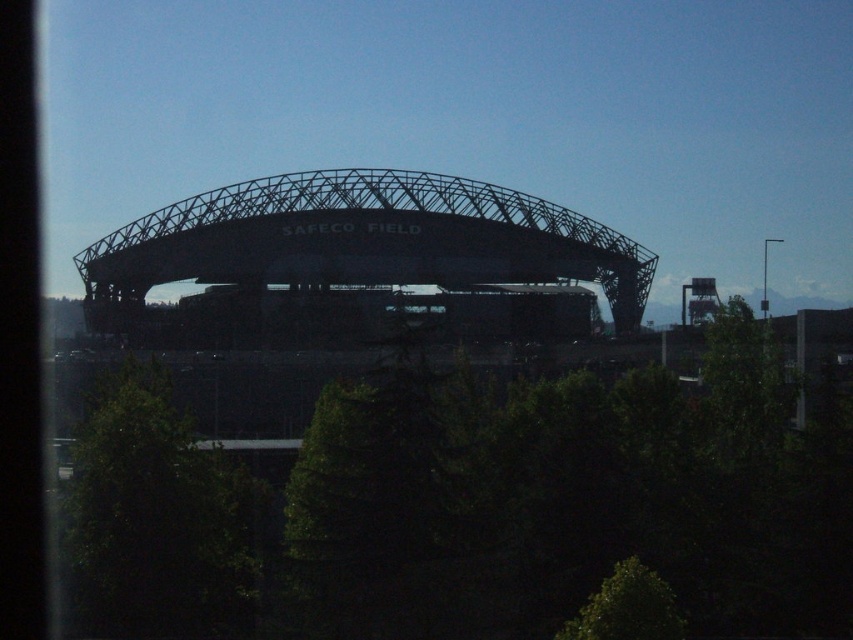
You are standing at the entrance of Safeco Field and want to locate the green leafy tree at center. According to the coordinates provided, where would you look to find it?

The green leafy tree at center is located at coordinates point (572, 499), so you should look towards the lower right direction from the entrance.

You are standing at the entrance of Safeco Field and notice two points marked on the ground. The first point is at coordinates point (x=766, y=625) and the second point is at point (x=732, y=349). Which point is closer to you when facing the stadium?

Point (x=766, y=625) is closer to you because it is in front of point (x=732, y=349) when facing the stadium.

You are a photographer standing in front of Safeco Field. You want to take a picture of the stadium with the green leafy tree at center and the green leafy tree at right in the background. Can you position yourself so that both trees are visible in the frame without one blocking the other?

The green leafy tree at center is in front of the green leafy tree at right, so positioning yourself so that both are visible without one blocking the other would require angling the camera to capture both trees in different planes. However, since the tree at center is closer, it may still partially block the tree at right depending on the camera angle and lens used.